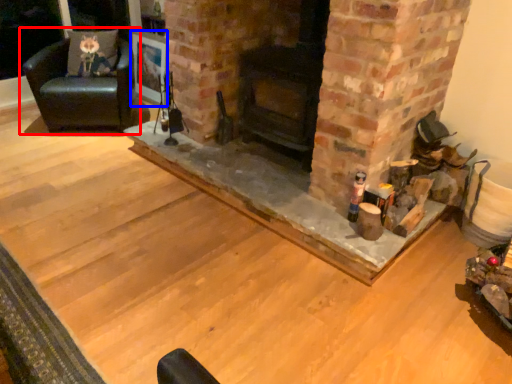
Question: Among these objects, which one is farthest to the camera, chair (highlighted by a red box) or picture frame (highlighted by a blue box)?

Choices:
 (A) chair
 (B) picture frame

Answer: (B)